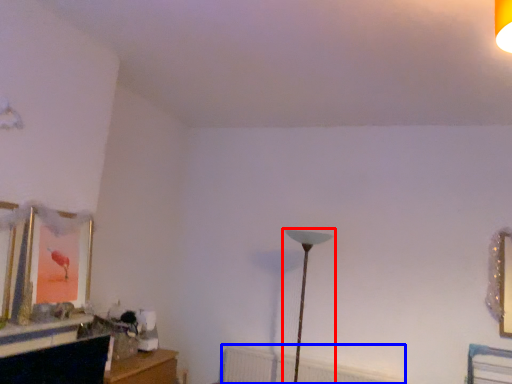
Question: Which object appears farthest to the camera in this image, lamp (highlighted by a red box) or radiator (highlighted by a blue box)?

Choices:
 (A) lamp
 (B) radiator

Answer: (B)